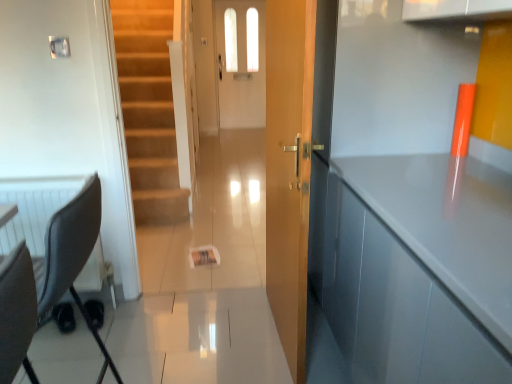
Question: Does wooden door at center appear on the left side of white glossy door at center?

Choices:
 (A) no
 (B) yes

Answer: (A)

Question: Could you tell me if wooden door at center is turned towards white glossy door at center?

Choices:
 (A) yes
 (B) no

Answer: (B)

Question: Considering the relative sizes of wooden door at center and white glossy door at center in the image provided, is wooden door at center thinner than white glossy door at center?

Choices:
 (A) yes
 (B) no

Answer: (A)

Question: Can we say wooden door at center lies outside white glossy door at center?

Choices:
 (A) yes
 (B) no

Answer: (A)

Question: Is the depth of wooden door at center less than that of white glossy door at center?

Choices:
 (A) no
 (B) yes

Answer: (B)

Question: Is wooden door at center smaller than white glossy door at center?

Choices:
 (A) yes
 (B) no

Answer: (A)

Question: Is white glossy door at center located outside wooden door at center?

Choices:
 (A) yes
 (B) no

Answer: (A)

Question: Is white glossy door at center wider than wooden door at center?

Choices:
 (A) yes
 (B) no

Answer: (A)

Question: Considering the relative sizes of white glossy door at center and wooden door at center in the image provided, is white glossy door at center taller than wooden door at center?

Choices:
 (A) no
 (B) yes

Answer: (B)

Question: Can you confirm if white glossy door at center is shorter than wooden door at center?

Choices:
 (A) yes
 (B) no

Answer: (B)

Question: Can you confirm if white glossy door at center is positioned to the right of wooden door at center?

Choices:
 (A) no
 (B) yes

Answer: (A)

Question: Is white glossy door at center facing away from wooden door at center?

Choices:
 (A) yes
 (B) no

Answer: (B)

Question: Considering the relative sizes of glossy gray cabinet at right and white glossy door at center in the image provided, is glossy gray cabinet at right thinner than white glossy door at center?

Choices:
 (A) yes
 (B) no

Answer: (B)